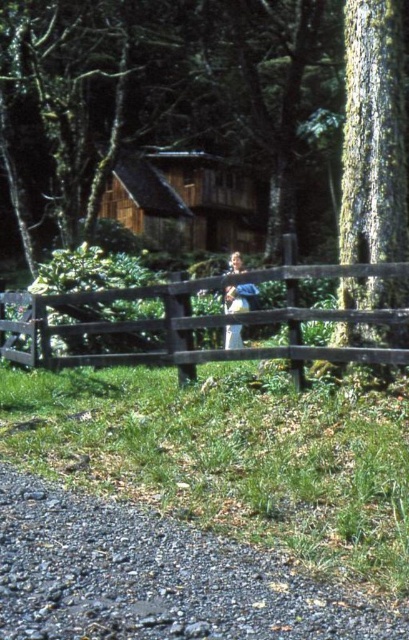
You are standing in a forest near the cabin and want to take a photo of the smooth bark tree at center and the brown wooden fence at center. Which object should you focus on first to ensure it appears sharp in your photo?

The smooth bark tree at center is in front of the brown wooden fence at center, so you should focus on the smooth bark tree at center first to ensure it appears sharp in your photo.

You are standing in the forest and see the smooth bark tree at center and the brown wooden fence at center. Which object is taller?

The smooth bark tree at center is taller than the brown wooden fence at center.